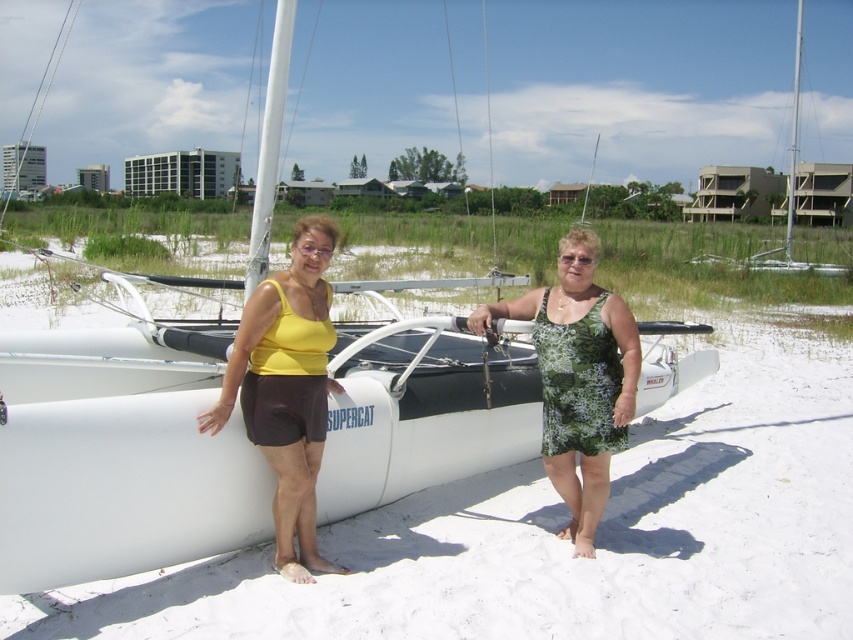
You are a photographer trying to capture a clear shot of the yellow fabric tank top at center and the white plastic sailboat at upper right. Since you want both objects to appear equally prominent in the photo, which object should you zoom in on more?

The yellow fabric tank top at center is smaller than the white plastic sailboat at upper right, so you should zoom in more on the yellow fabric tank top at center to make it appear larger in the photo and balance its prominence with the sailboat.

You are a photographer planning to take a group photo of the two people wearing the yellow fabric tank top at center and the green floral dress at center. The camera you are using has a minimum focusing distance of 1.5 meters. Will you need to adjust your position to ensure both subjects are in focus?

The yellow fabric tank top at center and green floral dress at center are 1.33 meters apart from each other. Since the camera requires a minimum focusing distance of 1.5 meters to focus on both subjects simultaneously, the current distance between them is insufficient. You will need to move further back or have the subjects spread out to increase the distance between them to at least 1.5 meters for proper focus.

You are a photographer standing at the camera position. You want to capture a photo of the yellow fabric tank top at center. Is the tank top within the standard 5 meters focus range of your camera?

The yellow fabric tank top at center is 4.14 meters from camera, so yes, it is within the standard 5 meters focus range and can be captured clearly.